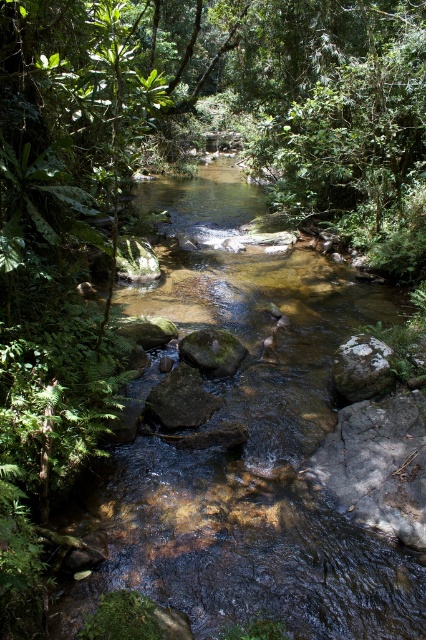
You are a hiker trying to cross the stream. You see the clear water stream at center and the smooth gray rock at center. Which one should you step on to ensure a stable footing?

The smooth gray rock at center is smaller in size than the clear water stream at center, so stepping on the smooth gray rock at center would provide a more stable footing since it is a solid surface.

You are a hiker trying to cross the stream. You see the clear water stream at center and the smooth brown rock at center. Which one should you step on to ensure a stable footing?

The smooth brown rock at center is smaller and more stable than the larger clear water stream at center, so stepping on the smooth brown rock at center would provide a better footing.

From the picture: You are standing at the edge of the stream in the forest scene. You notice two points marked in the image. Which point, point (163, 401) or point (371, 339), is closer to you?

Point (163, 401) is closer to you than point (371, 339).